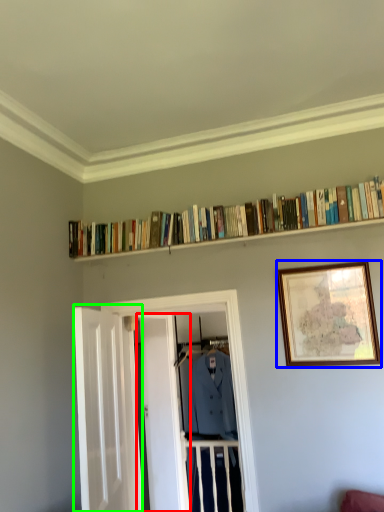
Question: Which object is the closest to the door (highlighted by a red box)? Choose among these: picture frame (highlighted by a blue box) or door (highlighted by a green box).

Choices:
 (A) picture frame
 (B) door

Answer: (B)